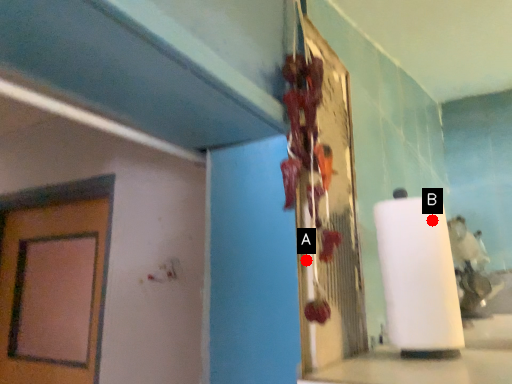
Question: Two points are circled on the image, labeled by A and B beside each circle. Which point appears farthest from the camera in this image?

Choices:
 (A) A is further
 (B) B is further

Answer: (B)